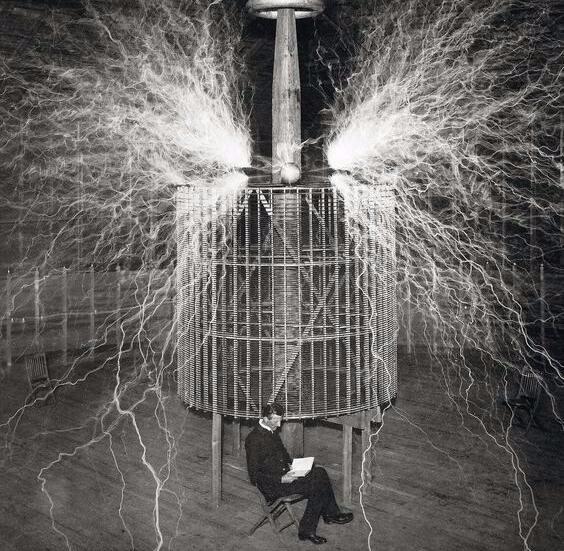
The image size is (564, 551). Identify the location of empty chair. (51, 378).